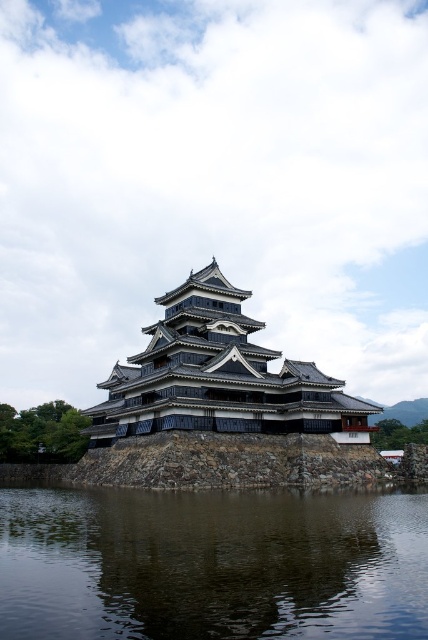
Question: Does dark reflective water at center appear on the left side of black stone fort at center?

Choices:
 (A) yes
 (B) no

Answer: (B)

Question: Which object is farther from the camera taking this photo?

Choices:
 (A) dark reflective water at center
 (B) black stone fort at center

Answer: (B)

Question: Does dark reflective water at center appear over black stone fort at center?

Choices:
 (A) no
 (B) yes

Answer: (A)

Question: Observing the image, what is the correct spatial positioning of dark reflective water at center in reference to black stone fort at center?

Choices:
 (A) below
 (B) above

Answer: (A)

Question: Which of the following is the farthest from the observer?

Choices:
 (A) dark reflective water at center
 (B) black stone fort at center

Answer: (B)

Question: Which point is closer to the camera?

Choices:
 (A) dark reflective water at center
 (B) black stone fort at center

Answer: (A)